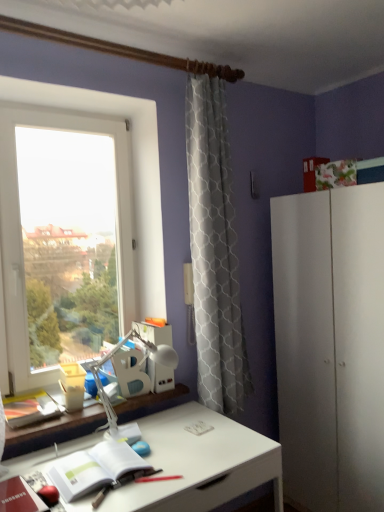
Where is `vacant area that is in front of white plastic table lamp at center`? vacant area that is in front of white plastic table lamp at center is located at coordinates (168, 473).